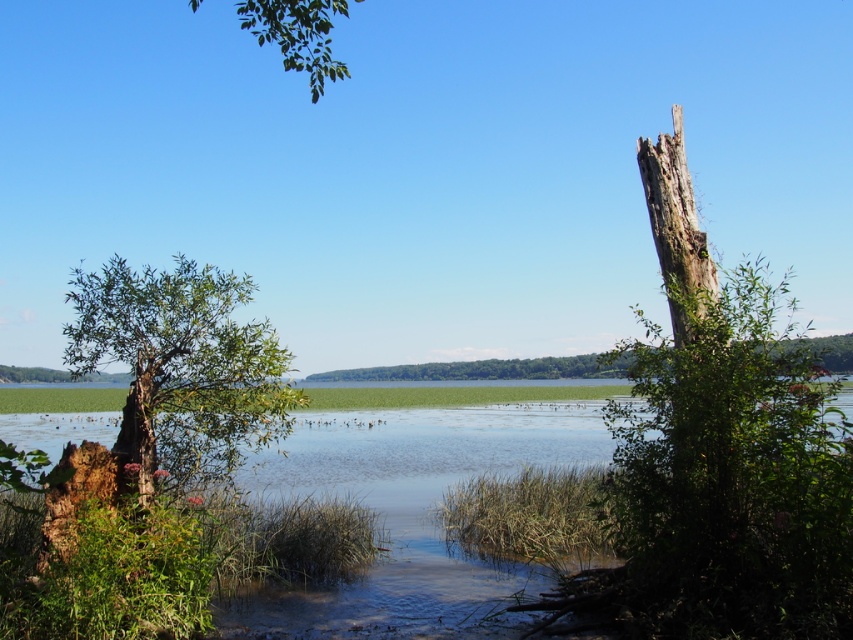
Question: Which object is the closest to the green leafy branch at upper center?

Choices:
 (A) green leafy tree at left
 (B) green grassy river at center

Answer: (A)

Question: Does green grassy river at center appear under green leafy tree at left?

Choices:
 (A) yes
 (B) no

Answer: (A)

Question: Considering the real-world distances, which object is farthest from the green leafy tree at left?

Choices:
 (A) green leafy branch at upper center
 (B) green grassy river at center

Answer: (B)

Question: Can you confirm if green grassy river at center is positioned to the right of green leafy branch at upper center?

Choices:
 (A) no
 (B) yes

Answer: (B)

Question: Is green leafy tree at left in front of green leafy branch at upper center?

Choices:
 (A) no
 (B) yes

Answer: (A)

Question: Which point appears closest to the camera in this image?

Choices:
 (A) (265, 428)
 (B) (340, 77)

Answer: (A)